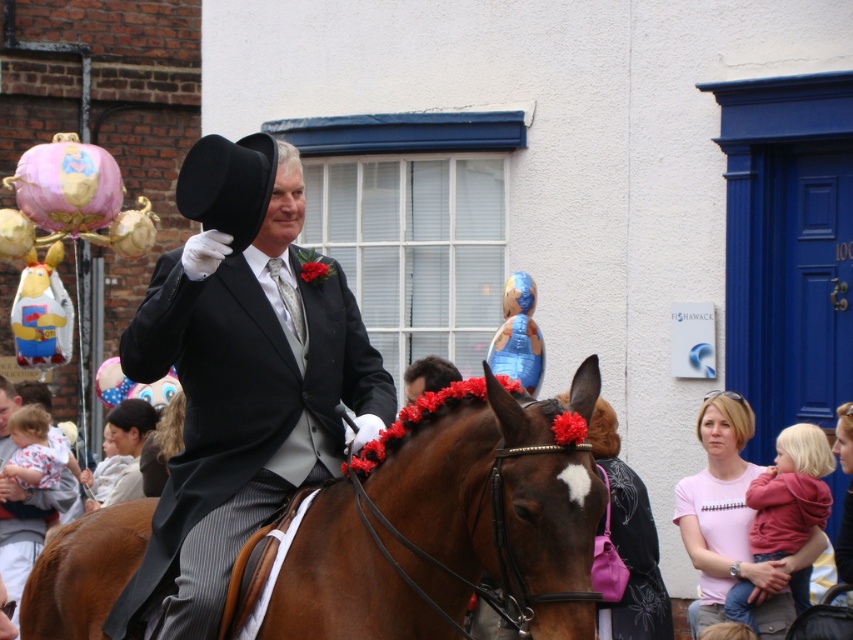
Is brown glossy horse at center wider than matte black top hat at center?

Correct, the width of brown glossy horse at center exceeds that of matte black top hat at center.

Does point (369, 534) lie behind point (334, 474)?

No.

Between point (589, 490) and point (364, 406), which one is positioned in front?

Point (589, 490) is more forward.

Identify the location of brown glossy horse at center. coord(451,524).